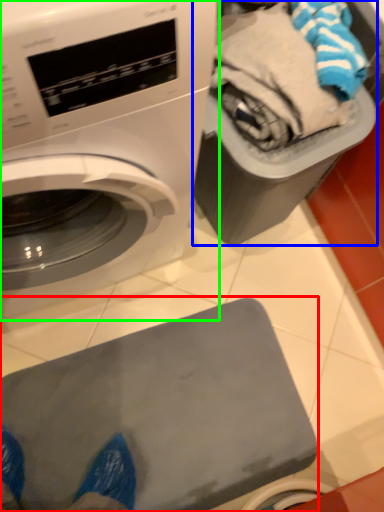
Question: Which object is the closest to the appliance (highlighted by a red box)? Choose among these: garbage (highlighted by a blue box) or washing machine (highlighted by a green box).

Choices:
 (A) garbage
 (B) washing machine

Answer: (B)